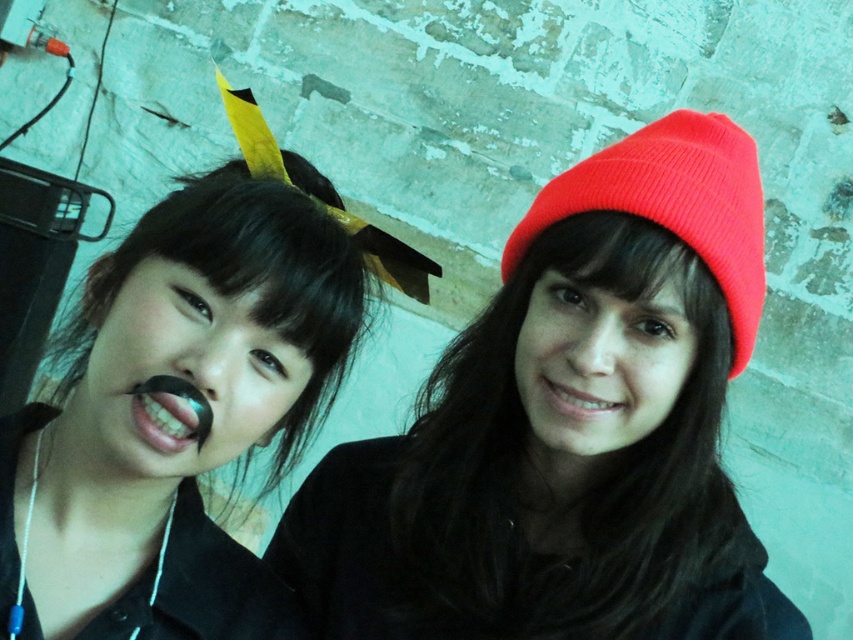
You are standing in front of the two people in the image. Based on their positions, which of the two points, point (695, 385) or point (712, 212), is farther away from you?

Point (695, 385) is behind point (712, 212), so it is farther away from you.

Based on the coordinates provided in the image, which of the two points, point (724, 342) or point (149, 388), is positioned further away from the viewer?

Point (724, 342) is behind point (149, 388), so it is further away from the viewer.

You are a photographer setting up a shot of the two people in the image. The camera is positioned to focus on the knit red beanie at center and the teethsmoothmouth at left. Which object should you adjust the focus settings for first if you want both to be in sharp focus?

The knit red beanie at center is much taller than teethsmoothmouth at left, so you should focus on the knit red beanie at center first to ensure both are in sharp focus.